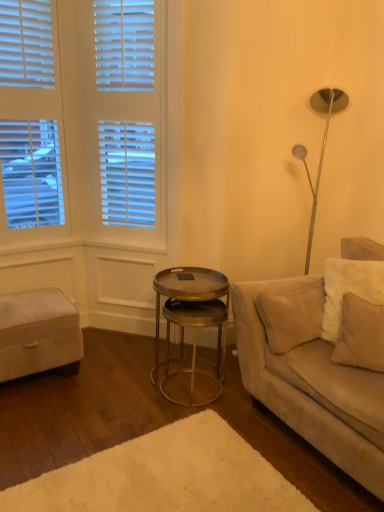
Question: Considering the relative sizes of white plush rug at lower center and suede beige couch at right in the image provided, is white plush rug at lower center smaller than suede beige couch at right?

Choices:
 (A) yes
 (B) no

Answer: (A)

Question: Does white plush rug at lower center turn towards suede beige couch at right?

Choices:
 (A) no
 (B) yes

Answer: (B)

Question: Is white plush rug at lower center taller than suede beige couch at right?

Choices:
 (A) yes
 (B) no

Answer: (B)

Question: Is suede beige couch at right inside white plush rug at lower center?

Choices:
 (A) yes
 (B) no

Answer: (B)

Question: Considering the relative sizes of white plush rug at lower center and suede beige couch at right in the image provided, is white plush rug at lower center wider than suede beige couch at right?

Choices:
 (A) yes
 (B) no

Answer: (A)

Question: From the image's perspective, is white fabric ottoman at lower left above or below metallic gold side table at center?

Choices:
 (A) below
 (B) above

Answer: (B)

Question: Considering the positions of white fabric ottoman at lower left and metallic gold side table at center in the image, is white fabric ottoman at lower left wider or thinner than metallic gold side table at center?

Choices:
 (A) thin
 (B) wide

Answer: (B)

Question: Considering the relative positions of white fabric ottoman at lower left and metallic gold side table at center in the image provided, is white fabric ottoman at lower left to the left or to the right of metallic gold side table at center?

Choices:
 (A) right
 (B) left

Answer: (B)

Question: Choose the correct answer: Is white fabric ottoman at lower left inside metallic gold side table at center or outside it?

Choices:
 (A) inside
 (B) outside

Answer: (B)

Question: Is white plush rug at lower center spatially inside suede beige couch at right, or outside of it?

Choices:
 (A) outside
 (B) inside

Answer: (A)

Question: From a real-world perspective, is white plush rug at lower center above or below suede beige couch at right?

Choices:
 (A) above
 (B) below

Answer: (B)

Question: From their relative heights in the image, would you say white plush rug at lower center is taller or shorter than suede beige couch at right?

Choices:
 (A) tall
 (B) short

Answer: (B)

Question: Is white plush rug at lower center wider or thinner than suede beige couch at right?

Choices:
 (A) thin
 (B) wide

Answer: (B)

Question: Is suede beige couch at right bigger or smaller than beige fabric pillow at right?

Choices:
 (A) big
 (B) small

Answer: (A)

Question: In the image, is suede beige couch at right positioned in front of or behind beige fabric pillow at right?

Choices:
 (A) behind
 (B) front

Answer: (B)